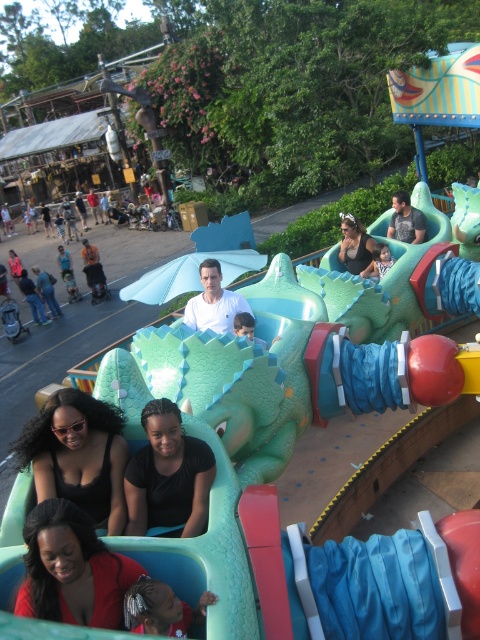
Question: Which is farther from the jeans at lower left?

Choices:
 (A) matte black tank top at center
 (B) matte black hair at lower left

Answer: (B)

Question: Can you confirm if matte black hair at lower left is positioned to the left of shiny silver hair at lower center?

Choices:
 (A) no
 (B) yes

Answer: (B)

Question: Which point is farther to the camera?

Choices:
 (A) smooth white shirt at center
 (B) black matte shirt at center
 (C) matte black hair at lower left

Answer: (A)

Question: Can you confirm if matte black hair at lower left is smaller than black matte hair at lower left?

Choices:
 (A) yes
 (B) no

Answer: (A)

Question: Which object is farther from the camera taking this photo?

Choices:
 (A) shiny silver hair at lower center
 (B) smooth white shirt at center
 (C) jeans at lower left
 (D) matte gray shirt at upper center

Answer: (C)

Question: From the image, what is the correct spatial relationship of black matte hair at lower left in relation to matte gray shirt at upper center?

Choices:
 (A) right
 (B) left

Answer: (B)